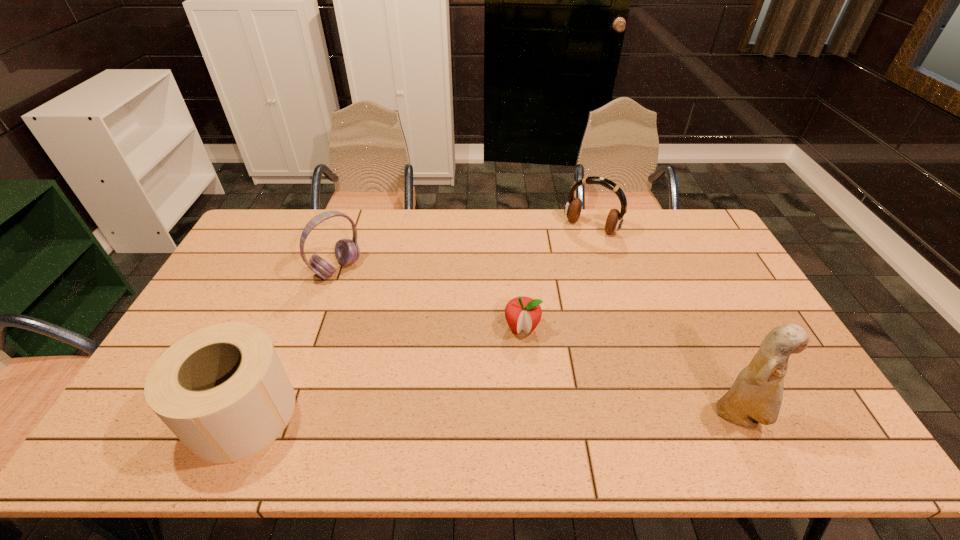
The width and height of the screenshot is (960, 540). Identify the location of vacant space on the desktop that is between the toilet tissue and the figurine and is positioned on the headband and ear cups of the left headset. (533, 415).

The width and height of the screenshot is (960, 540). Find the location of `free space on the desktop that is between the toilet tissue and the rightmost object and is positioned on the side where a bite is taken out of the third farthest object`. free space on the desktop that is between the toilet tissue and the rightmost object and is positioned on the side where a bite is taken out of the third farthest object is located at coordinates (516, 415).

The image size is (960, 540). Find the location of `vacant spot on the desktop that is between the toilet tissue and the tallest object and is positioned on the ear cup of the second object from right to left`. vacant spot on the desktop that is between the toilet tissue and the tallest object and is positioned on the ear cup of the second object from right to left is located at coordinates (468, 415).